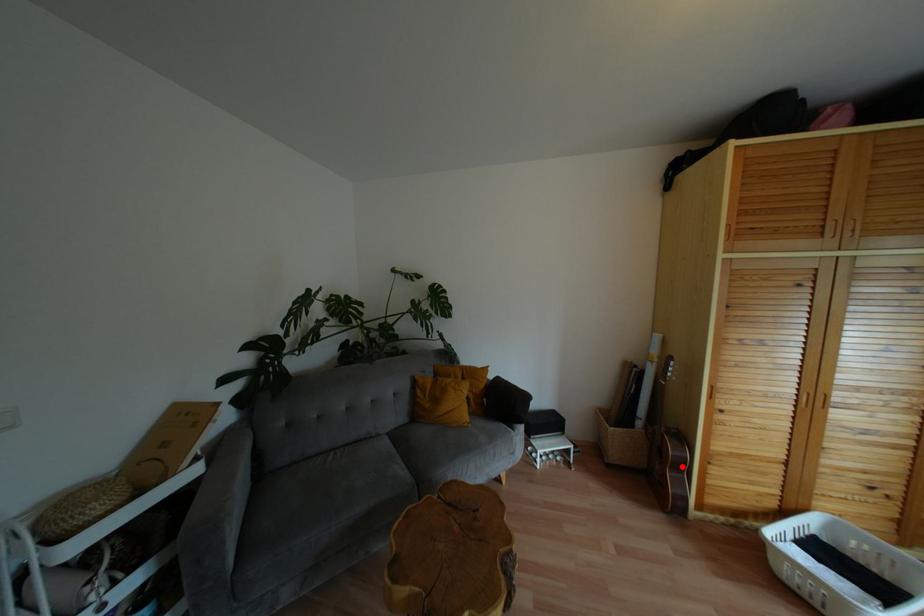
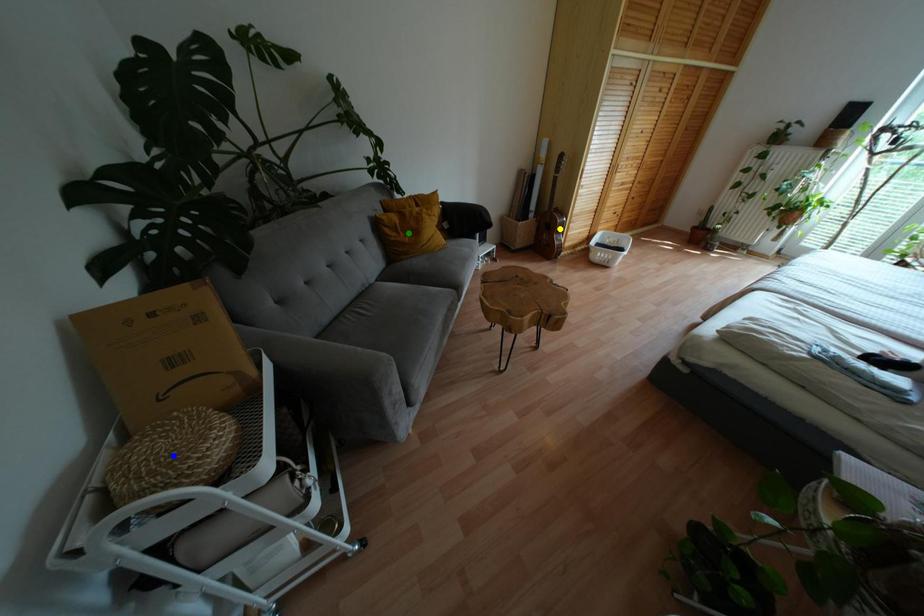
Question: I am providing you with two images of the same scene from different viewpoints. A red point is marked on the first image. You are given multiple points on the second image. Can you choose the point in image 2 that corresponds to the point in image 1?

Choices:
 (A) blue point
 (B) green point
 (C) yellow point

Answer: (C)